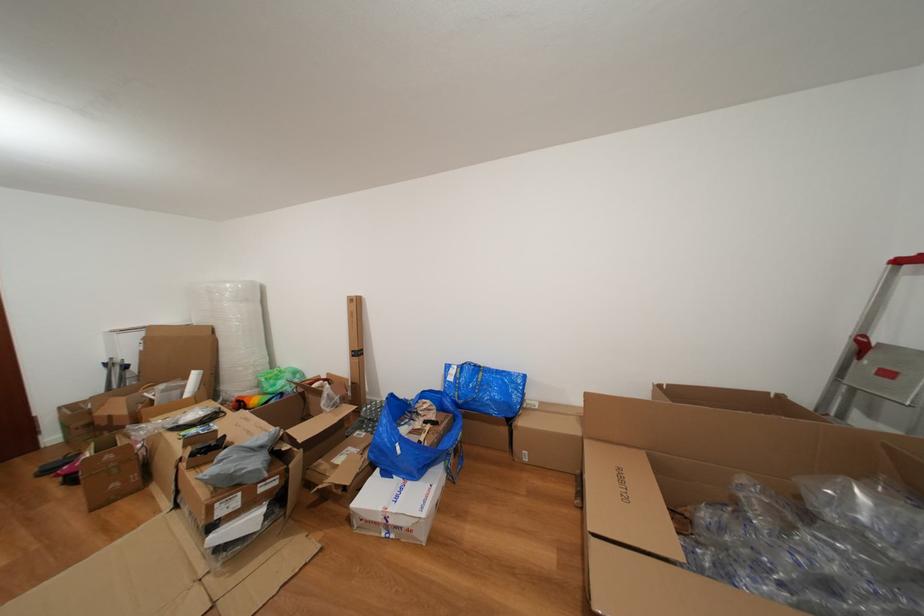
Locate an element on the screen. This screenshot has height=616, width=924. red ladder latch is located at coordinates (861, 345).